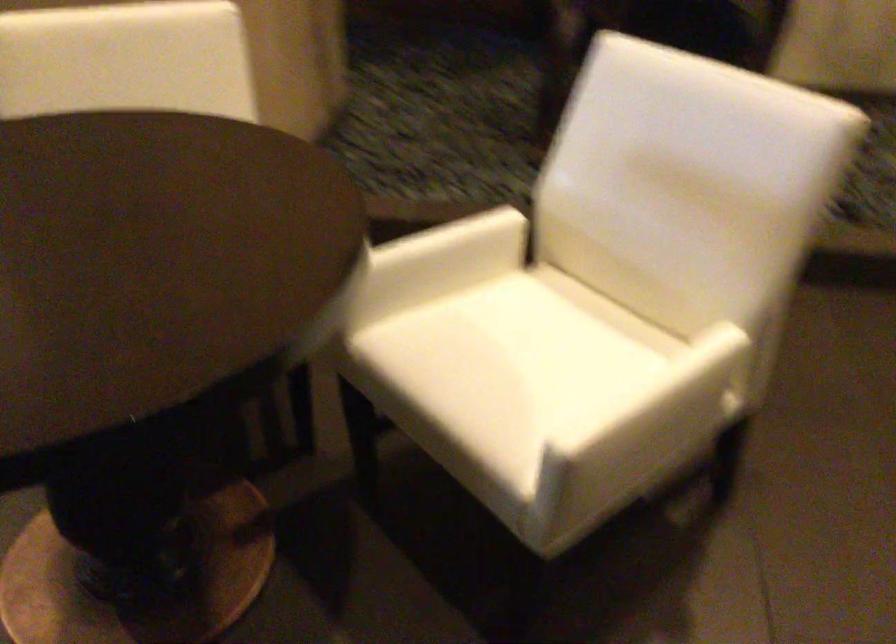
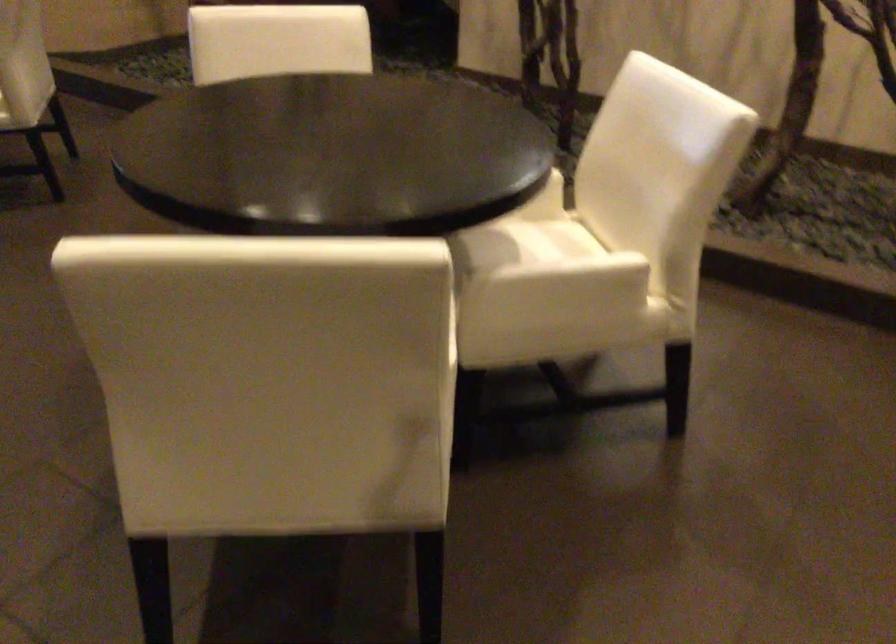
Question: The images are taken continuously from a first-person perspective. In which direction are you moving?

Choices:
 (A) Left
 (B) Right
 (C) Forward
 (D) Backward

Answer: (B)